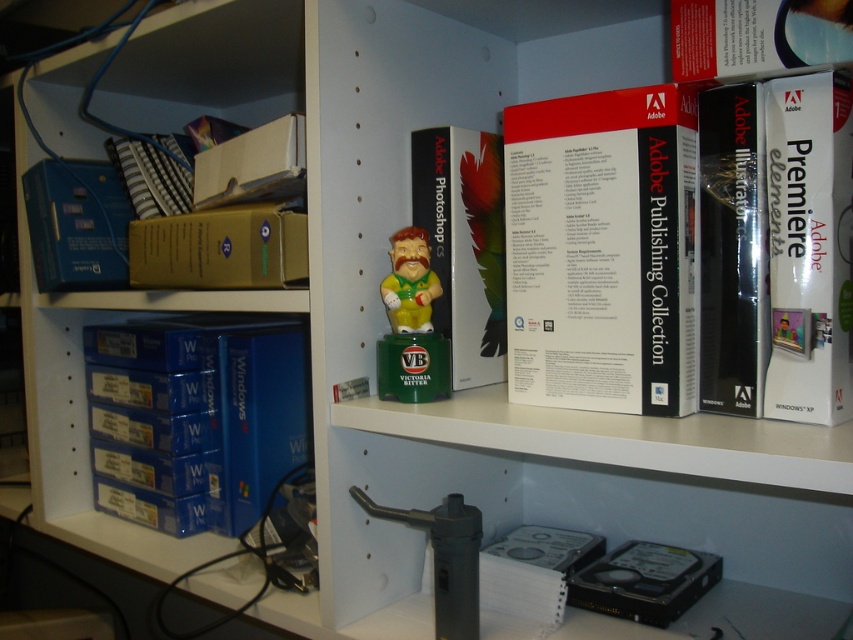
Question: Can you confirm if matte plastic bobblehead at center is bigger than green plastic figurine at center?

Choices:
 (A) yes
 (B) no

Answer: (A)

Question: Which point appears closest to the camera in this image?

Choices:
 (A) (96, 272)
 (B) (631, 188)
 (C) (467, 260)
 (D) (577, 561)

Answer: (B)

Question: Is the position of gold cardboard box at left more distant than that of blue matte box at left?

Choices:
 (A) yes
 (B) no

Answer: (B)

Question: Does white matte adobe publishing collection at center appear under gold cardboard box at left?

Choices:
 (A) yes
 (B) no

Answer: (A)

Question: Which point appears closest to the camera in this image?

Choices:
 (A) (723, 234)
 (B) (851, 259)
 (C) (432, 298)
 (D) (517, 561)

Answer: (B)

Question: Which point is closer to the camera?

Choices:
 (A) (244, 504)
 (B) (247, 252)
 (C) (431, 220)
 (D) (704, 368)

Answer: (D)